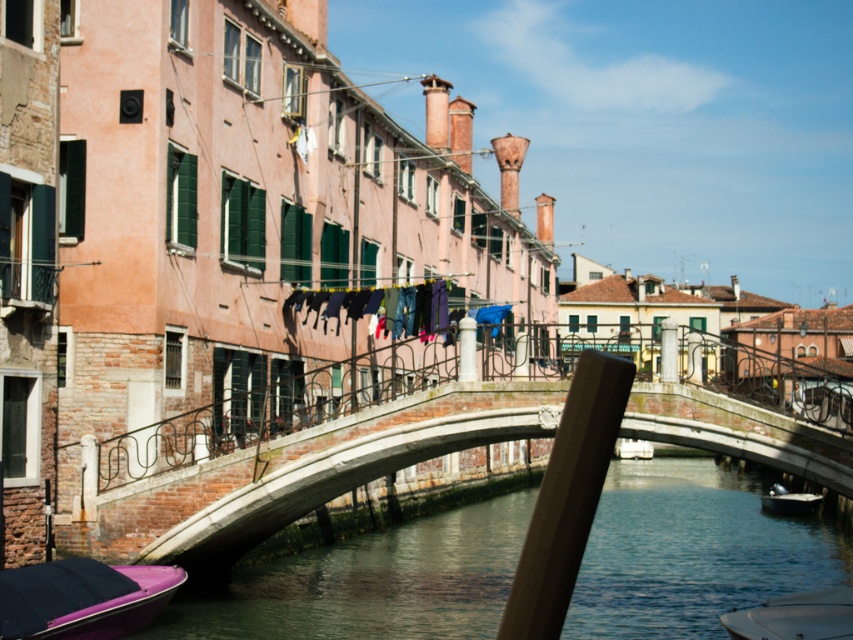
This screenshot has height=640, width=853. Find the location of `white plastic boat at lower right`. white plastic boat at lower right is located at coordinates (795, 616).

This screenshot has width=853, height=640. Describe the element at coordinates (795, 616) in the screenshot. I see `white plastic boat at lower right` at that location.

At what (x,y) coordinates should I click in order to perform the action: click on white plastic boat at lower right. Please return your answer as a coordinate pair (x, y). The image size is (853, 640). Looking at the image, I should click on (795, 616).

Can you confirm if clear water at bridge center is positioned above brick stone bridge at center?

Incorrect, clear water at bridge center is not positioned above brick stone bridge at center.

Is point (412, 602) less distant than point (364, 410)?

No.

Where is `clear water at bridge center`? The height and width of the screenshot is (640, 853). clear water at bridge center is located at coordinates (692, 552).

Is purple matte boat at lower left above white plastic boat at lower right?

Indeed, purple matte boat at lower left is positioned over white plastic boat at lower right.

Does purple matte boat at lower left have a lesser width compared to white plastic boat at lower right?

Correct, purple matte boat at lower left's width is less than white plastic boat at lower right's.

Find the location of `purple matte boat at lower left`. purple matte boat at lower left is located at coordinates (82, 598).